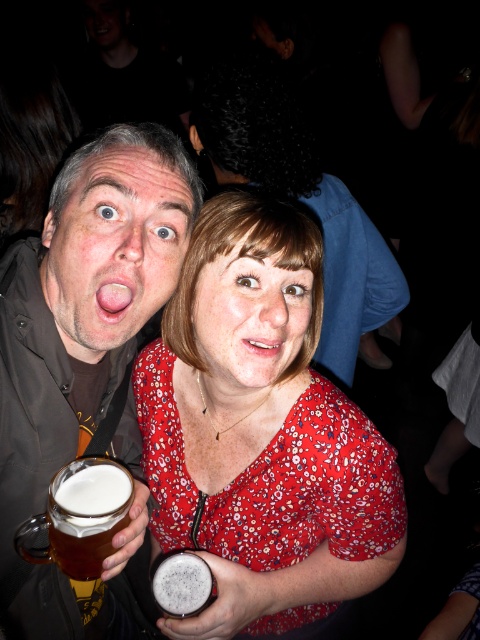
You are a photographer who wants to ensure both the matte skin face at center and the red floral blouse at center are clearly visible in your photo. Given their sizes, which one might you need to adjust your camera focus on to ensure it appears sharp?

The matte skin face at center is bigger than the red floral blouse at center, so you should focus on the matte skin face at center to ensure it appears sharp since larger objects may require more precise focus to maintain clarity.

You are a photographer standing in front of the scene. You want to take a closeup photo of the matte skin face at center. What is the minimum distance you need to maintain to ensure the subject is in focus?

The matte skin face at center is 65.75 centimeters away from the viewer, so you need to maintain at least 65.75 centimeters distance to ensure the subject is in focus.